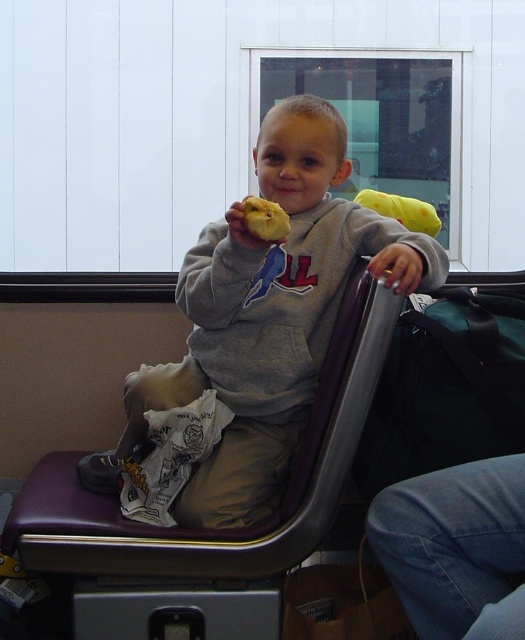
Consider the image. Who is more distant from viewer, [276,308] or [354,323]?

The point [276,308] is more distant.

In the scene shown: Does gray fleece sweatshirt at center have a lesser width compared to purple leather chair at center?

Correct, gray fleece sweatshirt at center's width is less than purple leather chair at center's.

Between point (135, 408) and point (280, 550), which one is positioned behind?

Point (135, 408)

I want to click on gray fleece sweatshirt at center, so click(x=267, y=316).

Can you confirm if gray fleece sweatshirt at center is smaller than yellow crumbly pastry at center?

No.

Does point (215, 488) come in front of point (257, 196)?

No, (215, 488) is further to viewer.

At what (x,y) coordinates should I click in order to perform the action: click on gray fleece sweatshirt at center. Please return your answer as a coordinate pair (x, y). Looking at the image, I should click on (267, 316).

Where is `gray fleece sweatshirt at center`? gray fleece sweatshirt at center is located at coordinates (267, 316).

What do you see at coordinates (219, 531) in the screenshot?
I see `purple leather chair at center` at bounding box center [219, 531].

Can you confirm if purple leather chair at center is shorter than yellow crumbly pastry at center?

Incorrect, purple leather chair at center's height does not fall short of yellow crumbly pastry at center's.

At what (x,y) coordinates should I click in order to perform the action: click on purple leather chair at center. Please return your answer as a coordinate pair (x, y). Image resolution: width=525 pixels, height=640 pixels. Looking at the image, I should click on (219, 531).

I want to click on purple leather chair at center, so (x=219, y=531).